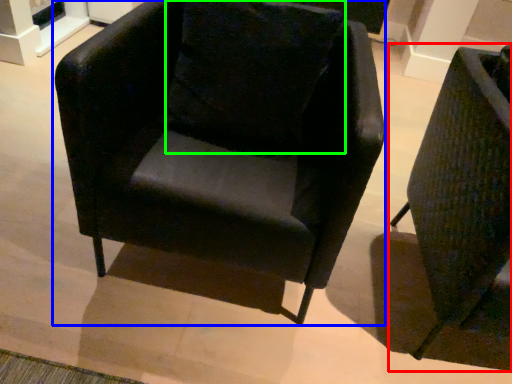
Question: Which is farther away from chair (highlighted by a red box)? chair (highlighted by a blue box) or pillow (highlighted by a green box)?

Choices:
 (A) chair
 (B) pillow

Answer: (B)